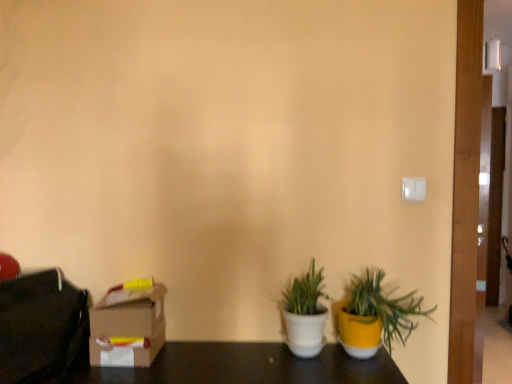
Locate an element on the screen. The image size is (512, 384). cardboard box at lower left is located at coordinates (127, 327).

Measure the distance between point [71,285] and camera.

A distance of 1.48 meters exists between point [71,285] and camera.

Locate an element on the screen. matte black bag at left is located at coordinates (40, 327).

Measure the distance between point (x=296, y=309) and camera.

Point (x=296, y=309) is 1.37 meters from camera.

I want to click on cardboard box at lower left, so click(x=127, y=327).

From a real-world perspective, is matte black bag at left located beneath cardboard box at lower left?

Incorrect, from a real-world perspective, matte black bag at left is higher than cardboard box at lower left.

Considering the points (18, 286) and (137, 366), which point is behind, point (18, 286) or point (137, 366)?

The point (18, 286) is farther from the camera.

Considering the sizes of matte black bag at left and cardboard box at lower left in the image, is matte black bag at left wider or thinner than cardboard box at lower left?

Clearly, matte black bag at left has more width compared to cardboard box at lower left.

Is matte black bag at left in front of cardboard box at lower left?

Yes, the depth of matte black bag at left is less than that of cardboard box at lower left.

From the image's perspective, is cardboard box at lower left located above or below matte black bag at left?

cardboard box at lower left is situated lower than matte black bag at left in the image.

Who is taller, cardboard box at lower left or matte black bag at left?

With more height is matte black bag at left.

Which is behind, cardboard box at lower left or matte black bag at left?

cardboard box at lower left.

How many degrees apart are the facing directions of cardboard box at lower left and matte black bag at left?

The angle between the facing direction of cardboard box at lower left and the facing direction of matte black bag at left is 68.5 degrees.

Considering the positions of points (100, 336) and (373, 340), is point (100, 336) closer to camera compared to point (373, 340)?

Yes, it is.

Does cardboard box at lower left touch yellow matte pot at lower right, which is the 1th houseplant in right-to-left order?

No, cardboard box at lower left is not making contact with yellow matte pot at lower right, which is the 1th houseplant in right-to-left order.

Is cardboard box at lower left wider or thinner than yellow matte pot at lower right, the second houseplant in the left-to-right sequence?

In the image, cardboard box at lower left appears to be more narrow than yellow matte pot at lower right, the second houseplant in the left-to-right sequence.

From a real-world perspective, does cardboard box at lower left stand above yellow matte pot at lower right, which is the 1th houseplant in right-to-left order?

Actually, cardboard box at lower left is physically below yellow matte pot at lower right, which is the 1th houseplant in right-to-left order, in the real world.

Which is more to the left, matte black bag at left or white matte pot at center, the second houseplant viewed from the right?

matte black bag at left is more to the left.

Would you say matte black bag at left is outside white matte pot at center, the second houseplant viewed from the right?

Absolutely, matte black bag at left is external to white matte pot at center, the second houseplant viewed from the right.

Where is `the 2nd houseplant behind when counting from the matte black bag at left`? Image resolution: width=512 pixels, height=384 pixels. the 2nd houseplant behind when counting from the matte black bag at left is located at coordinates (305, 314).

Is white matte pot at center, the second houseplant viewed from the right, completely or partially outside of yellow matte pot at lower right, which is the 1th houseplant in right-to-left order?

That's correct, white matte pot at center, the second houseplant viewed from the right, is outside of yellow matte pot at lower right, which is the 1th houseplant in right-to-left order.

What's the angular difference between white matte pot at center, the second houseplant viewed from the right, and yellow matte pot at lower right, which is the 1th houseplant in right-to-left order,'s facing directions?

0.773 degrees.

Does point (298, 277) come in front of point (411, 304)?

Yes, point (298, 277) is closer to viewer.

Is white matte pot at center, the second houseplant viewed from the right, with yellow matte pot at lower right, which is the 1th houseplant in right-to-left order?

white matte pot at center, the second houseplant viewed from the right, and yellow matte pot at lower right, which is the 1th houseplant in right-to-left order, are not in contact.

From a real-world perspective, between yellow matte pot at lower right, which is the 1th houseplant in right-to-left order, and cardboard box at lower left, who is vertically lower?

From a 3D spatial view, cardboard box at lower left is below.

Considering the relative sizes of yellow matte pot at lower right, which is the 1th houseplant in right-to-left order, and cardboard box at lower left in the image provided, is yellow matte pot at lower right, which is the 1th houseplant in right-to-left order, taller than cardboard box at lower left?

Indeed, yellow matte pot at lower right, which is the 1th houseplant in right-to-left order, has a greater height compared to cardboard box at lower left.

From the image's perspective, is yellow matte pot at lower right, which is the 1th houseplant in right-to-left order, above or below cardboard box at lower left?

Clearly, from the image's perspective, yellow matte pot at lower right, which is the 1th houseplant in right-to-left order, is above cardboard box at lower left.

What are the coordinates of `the 1st houseplant to the right when counting from the cardboard box at lower left` in the screenshot? It's located at (305, 314).

Based on the photo, is cardboard box at lower left taller or shorter than white matte pot at center, which ranks as the first houseplant in left-to-right order?

Clearly, cardboard box at lower left is shorter compared to white matte pot at center, which ranks as the first houseplant in left-to-right order.

Based on the photo, which is closer, (163, 343) or (302, 284)?

Clearly, point (163, 343) is closer to the camera than point (302, 284).

Can you tell me how much cardboard box at lower left and white matte pot at center, which ranks as the first houseplant in left-to-right order, differ in facing direction?

3.44 degrees separate the facing orientations of cardboard box at lower left and white matte pot at center, which ranks as the first houseplant in left-to-right order.

The image size is (512, 384). I want to click on cardboard box directly beneath the matte black bag at left (from a real-world perspective), so click(x=127, y=327).

In order to click on cardboard box lying on the right of matte black bag at left in this screenshot , I will do `click(127, 327)`.

Looking at the image, which one is located closer to yellow matte pot at lower right, which is the 1th houseplant in right-to-left order, cardboard box at lower left or white matte pot at center, the second houseplant viewed from the right?

white matte pot at center, the second houseplant viewed from the right, is positioned closer to the anchor yellow matte pot at lower right, which is the 1th houseplant in right-to-left order.

When comparing their distances from matte black bag at left, does yellow matte pot at lower right, which is the 1th houseplant in right-to-left order, or cardboard box at lower left seem further?

yellow matte pot at lower right, which is the 1th houseplant in right-to-left order, is positioned further to the anchor matte black bag at left.

Estimate the real-world distances between objects in this image. Which object is further from matte black bag at left, white matte pot at center, which ranks as the first houseplant in left-to-right order, or cardboard box at lower left?

white matte pot at center, which ranks as the first houseplant in left-to-right order, is positioned further to the anchor matte black bag at left.

Looking at the image, which one is located closer to cardboard box at lower left, matte black bag at left or white matte pot at center, which ranks as the first houseplant in left-to-right order?

Among the two, matte black bag at left is located nearer to cardboard box at lower left.

From the image, which object appears to be farther from white matte pot at center, the second houseplant viewed from the right, cardboard box at lower left or matte black bag at left?

Based on the image, matte black bag at left appears to be further to white matte pot at center, the second houseplant viewed from the right.

Based on their spatial positions, is yellow matte pot at lower right, which is the 1th houseplant in right-to-left order, or cardboard box at lower left further from white matte pot at center, which ranks as the first houseplant in left-to-right order?

cardboard box at lower left.

From the image, which object appears to be nearer to cardboard box at lower left, yellow matte pot at lower right, the second houseplant in the left-to-right sequence, or white matte pot at center, the second houseplant viewed from the right?

white matte pot at center, the second houseplant viewed from the right, is positioned closer to the anchor cardboard box at lower left.

When comparing their distances from cardboard box at lower left, does matte black bag at left or yellow matte pot at lower right, which is the 1th houseplant in right-to-left order, seem further?

Based on the image, yellow matte pot at lower right, which is the 1th houseplant in right-to-left order, appears to be further to cardboard box at lower left.

This screenshot has width=512, height=384. What are the coordinates of `cardboard box located between matte black bag at left and yellow matte pot at lower right, which is the 1th houseplant in right-to-left order, in the left-right direction` in the screenshot? It's located at (127, 327).

Find the location of a particular element. houseplant between cardboard box at lower left and yellow matte pot at lower right, the second houseplant in the left-to-right sequence, in the horizontal direction is located at coordinates (305, 314).

Where is `houseplant between matte black bag at left and yellow matte pot at lower right, the second houseplant in the left-to-right sequence`? The height and width of the screenshot is (384, 512). houseplant between matte black bag at left and yellow matte pot at lower right, the second houseplant in the left-to-right sequence is located at coordinates (305, 314).

The height and width of the screenshot is (384, 512). I want to click on cardboard box between matte black bag at left and white matte pot at center, which ranks as the first houseplant in left-to-right order, so click(127, 327).